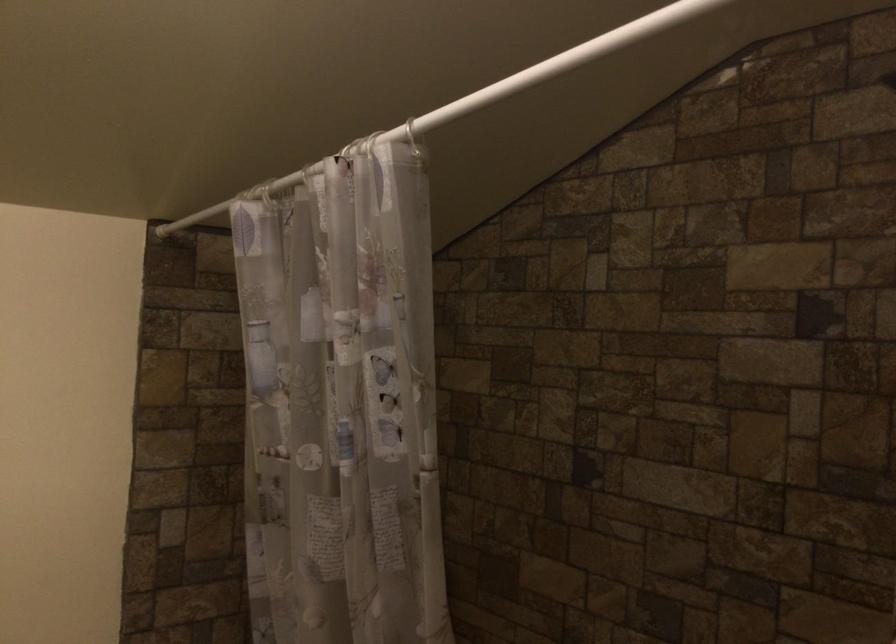
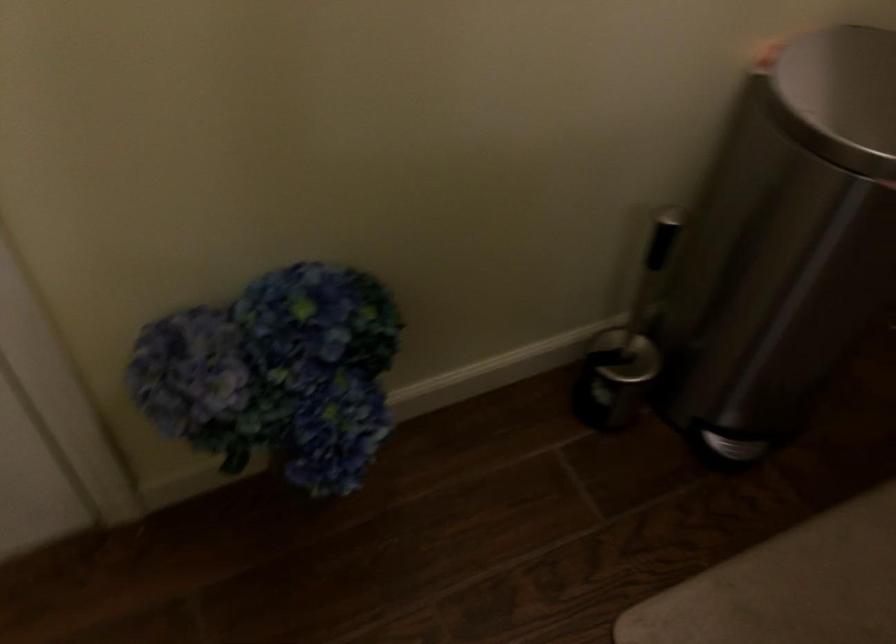
The images are taken continuously from a first-person perspective. In which direction is your viewpoint rotating?

The camera's rotation is toward left-down.